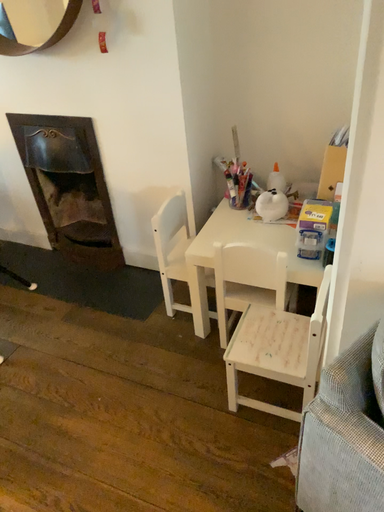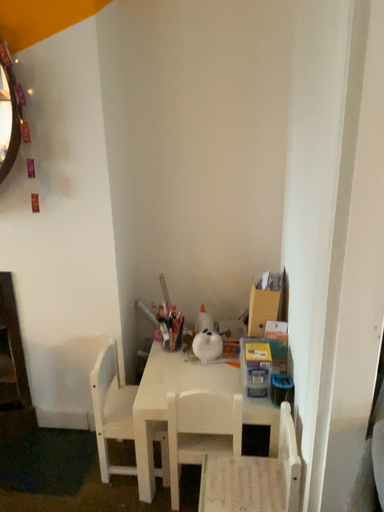
Question: Which way did the camera rotate in the video?

Choices:
 (A) rotated downward
 (B) rotated upward

Answer: (B)